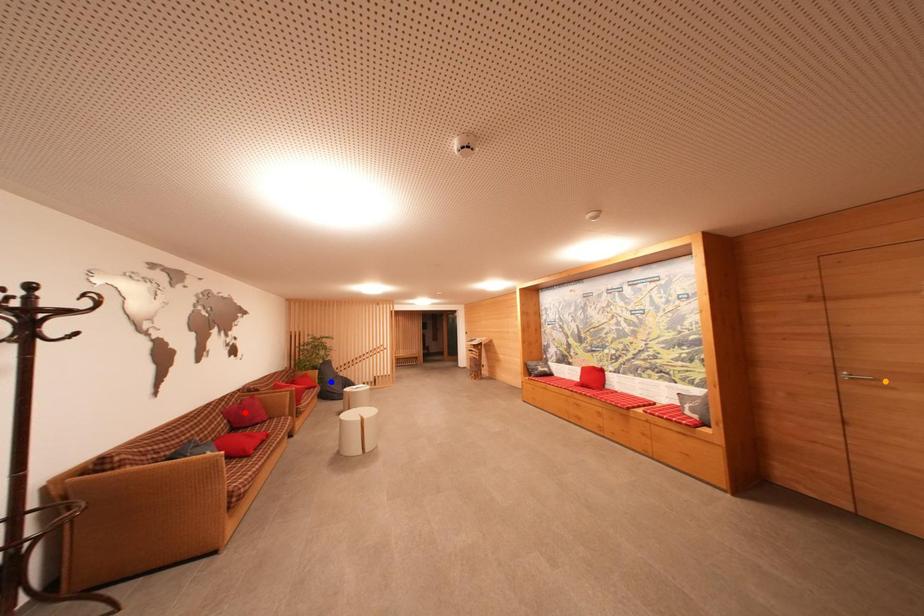
Order these from nearest to farthest:
1. orange point
2. red point
3. blue point

1. blue point
2. red point
3. orange point